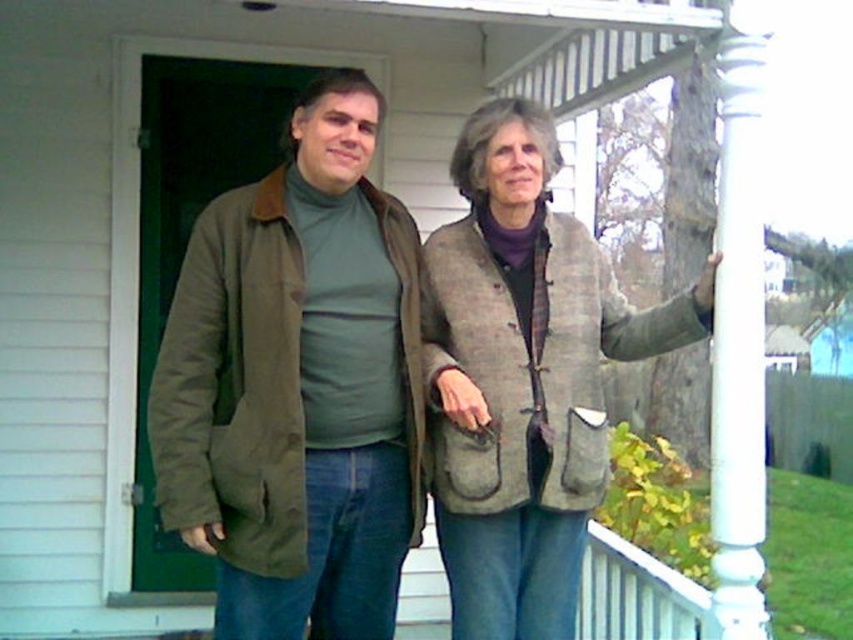
Question: Considering the real-world distances, which object is farthest from the white glossy column at right?

Choices:
 (A) gray woolen vest at center
 (B) matte olive-green jacket at center

Answer: (B)

Question: Is matte olive-green jacket at center positioned in front of white glossy column at right?

Choices:
 (A) no
 (B) yes

Answer: (A)

Question: Can you confirm if gray woolen vest at center is positioned to the left of white glossy column at right?

Choices:
 (A) no
 (B) yes

Answer: (B)

Question: Considering the real-world distances, which object is closest to the matte olive-green jacket at center?

Choices:
 (A) gray woolen vest at center
 (B) white glossy column at right

Answer: (A)

Question: Among these objects, which one is nearest to the camera?

Choices:
 (A) matte olive-green jacket at center
 (B) gray woolen vest at center
 (C) white glossy column at right

Answer: (C)

Question: Is matte olive-green jacket at center to the right of gray woolen vest at center from the viewer's perspective?

Choices:
 (A) no
 (B) yes

Answer: (A)